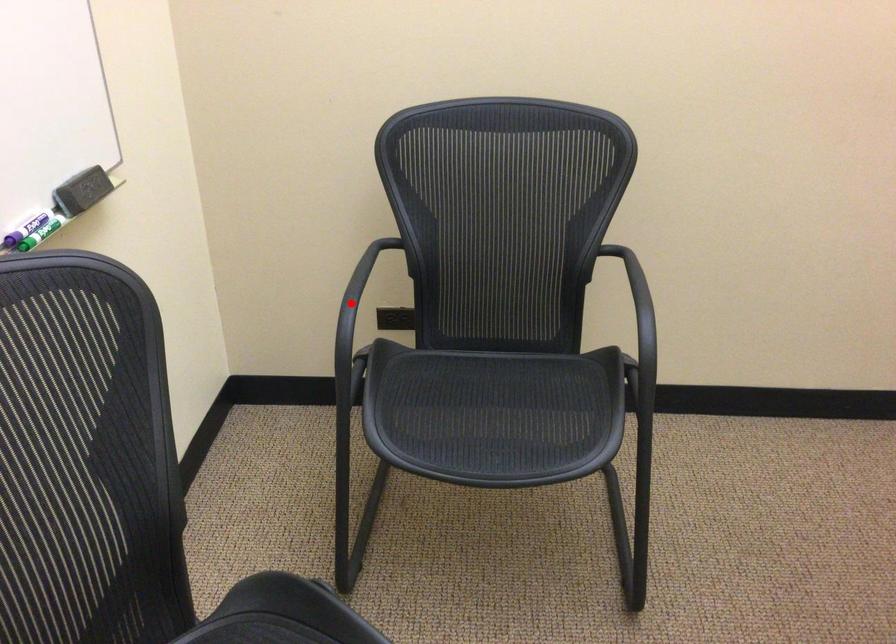
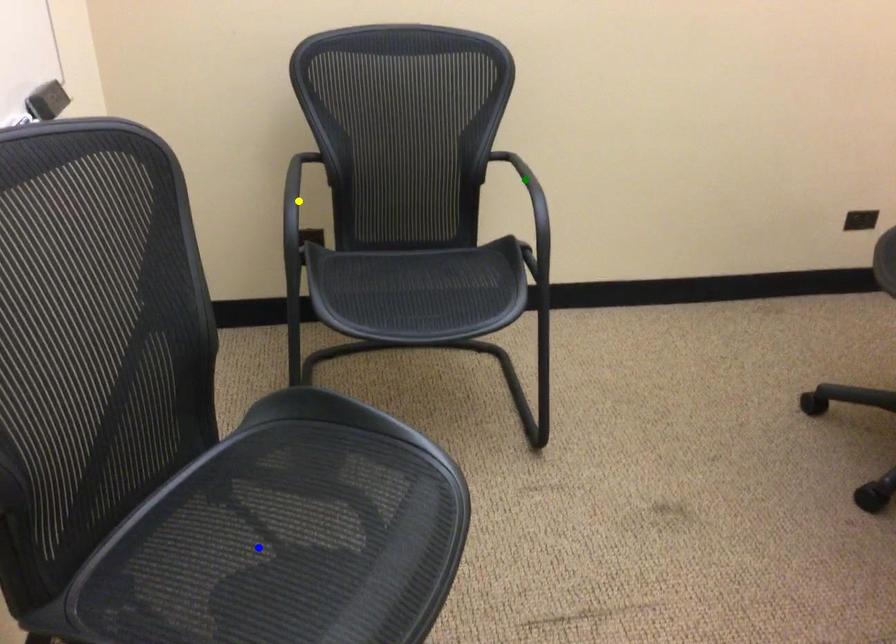
Question: I am providing you with two images of the same scene from different viewpoints. A red point is marked on the first image. You are given multiple points on the second image. Which point in image 2 represents the same 3d spot as the red point in image 1?

Choices:
 (A) yellow point
 (B) green point
 (C) blue point

Answer: (A)